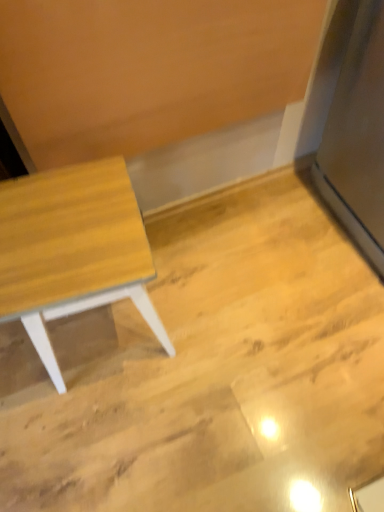
You are a GUI agent. You are given a task and a screenshot of the screen. Output one action in this format:
    pyautogui.click(x=<x>, y=<y>)
    Task: Click on the free space in front of light wood table at left
    
    Given the screenshot: What is the action you would take?
    pyautogui.click(x=100, y=431)